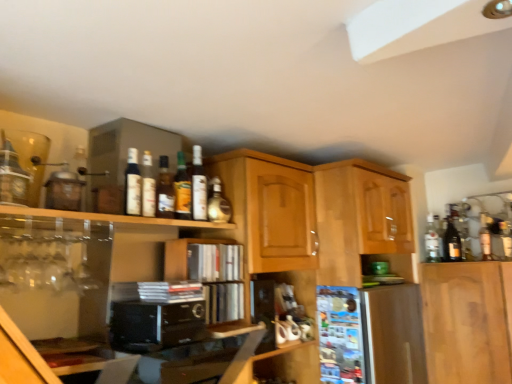
Question: Does clear glass bottle at right, which is the first bottle in right-to-left order, have a smaller size compared to black matte microwave at center?

Choices:
 (A) yes
 (B) no

Answer: (A)

Question: Does clear glass bottle at right, which appears as the first bottle when viewed from the back, have a lesser height compared to black matte microwave at center?

Choices:
 (A) no
 (B) yes

Answer: (A)

Question: Is clear glass bottle at right, placed as the 7th bottle when sorted from front to back, outside of black matte microwave at center?

Choices:
 (A) no
 (B) yes

Answer: (B)

Question: From the image's perspective, is clear glass bottle at right, placed as the 7th bottle when sorted from front to back, located above black matte microwave at center?

Choices:
 (A) yes
 (B) no

Answer: (A)

Question: Is clear glass bottle at right, which is the first bottle in right-to-left order, closer to the viewer compared to black matte microwave at center?

Choices:
 (A) yes
 (B) no

Answer: (B)

Question: Does point (178, 249) appear closer or farther from the camera than point (424, 241)?

Choices:
 (A) closer
 (B) farther

Answer: (A)

Question: Is wooden cabinet at center, arranged as the third cabinetry when viewed from the right, in front of or behind clear glass bottle at right, arranged as the seventh bottle when viewed from the left, in the image?

Choices:
 (A) front
 (B) behind

Answer: (A)

Question: From the image's perspective, relative to clear glass bottle at right, arranged as the seventh bottle when viewed from the left, is wooden cabinet at center, arranged as the third cabinetry when viewed from the right, above or below?

Choices:
 (A) below
 (B) above

Answer: (A)

Question: Looking at the image, does wooden cabinet at center, arranged as the third cabinetry when viewed from the right, seem bigger or smaller compared to clear glass bottle at right, placed as the 7th bottle when sorted from front to back?

Choices:
 (A) small
 (B) big

Answer: (B)

Question: From the image's perspective, is wooden cabinet at center, the first cabinetry positioned from the left, above or below glossy wood cabinet at upper right, positioned as the 3th cabinetry in left-to-right order?

Choices:
 (A) above
 (B) below

Answer: (B)

Question: Is point (169, 274) positioned closer to the camera than point (346, 162)?

Choices:
 (A) farther
 (B) closer

Answer: (B)

Question: Is wooden cabinet at center, the first cabinetry positioned from the left, in front of or behind glossy wood cabinet at upper right, the first cabinetry viewed from the right, in the image?

Choices:
 (A) front
 (B) behind

Answer: (A)

Question: Considering the positions of wooden cabinet at center, arranged as the third cabinetry when viewed from the right, and glossy wood cabinet at upper right, positioned as the 3th cabinetry in left-to-right order, in the image, is wooden cabinet at center, arranged as the third cabinetry when viewed from the right, taller or shorter than glossy wood cabinet at upper right, positioned as the 3th cabinetry in left-to-right order,?

Choices:
 (A) tall
 (B) short

Answer: (B)

Question: From a real-world perspective, is wooden cabinet at upper center, marked as the 2th cabinetry in a left-to-right arrangement, above or below matte glass bottle at upper center, positioned as the sixth bottle in front-to-back order?

Choices:
 (A) below
 (B) above

Answer: (A)

Question: Based on their sizes in the image, would you say wooden cabinet at upper center, the second cabinetry in the right-to-left sequence, is bigger or smaller than matte glass bottle at upper center, the sixth bottle in the left-to-right sequence?

Choices:
 (A) big
 (B) small

Answer: (A)